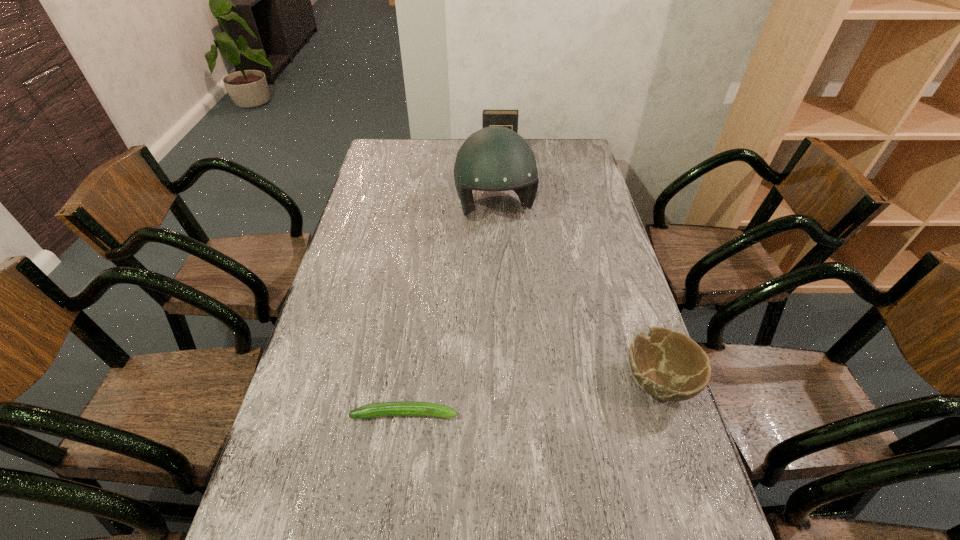
In order to click on free location at the right edge of the desktop in this screenshot , I will do `click(567, 240)`.

In the image, there is a desktop. At what (x,y) coordinates should I click in order to perform the action: click on free space at the far right corner. Please return your answer as a coordinate pair (x, y). The image size is (960, 540). Looking at the image, I should click on (562, 139).

Where is `vacant area at the near right corner of the desktop`? vacant area at the near right corner of the desktop is located at coordinates (701, 507).

The width and height of the screenshot is (960, 540). I want to click on blank region between the bowl and the third nearest object, so click(576, 295).

Find the location of a particular element. blank region between the bowl and the second farthest object is located at coordinates (576, 295).

You are a GUI agent. You are given a task and a screenshot of the screen. Output one action in this format:
    pyautogui.click(x=<x>, y=<y>)
    Task: Click on the vacant point located between the second tallest object and the bowl
    Image resolution: width=960 pixels, height=540 pixels.
    Given the screenshot: What is the action you would take?
    pyautogui.click(x=579, y=267)

What are the coordinates of `vacant area that lies between the zucchini and the bowl` in the screenshot? It's located at (531, 397).

Where is `unoccupied position between the third tallest object and the tallest object`? unoccupied position between the third tallest object and the tallest object is located at coordinates (576, 295).

You are a GUI agent. You are given a task and a screenshot of the screen. Output one action in this format:
    pyautogui.click(x=<x>, y=<y>)
    Task: Click on the free spot between the rightmost object and the shortest object
    
    Given the screenshot: What is the action you would take?
    pyautogui.click(x=531, y=397)

At what (x,y) coordinates should I click in order to perform the action: click on free space between the bowl and the second farthest object. Please return your answer as a coordinate pair (x, y). This screenshot has width=960, height=540. Looking at the image, I should click on (576, 295).